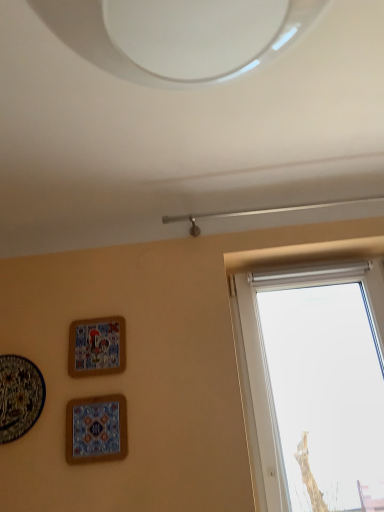
Where is `matte ceramic plate at lower left, acting as the 3th picture frame starting from the right`? This screenshot has width=384, height=512. matte ceramic plate at lower left, acting as the 3th picture frame starting from the right is located at coordinates (19, 396).

Where is `matte ceramic tile at lower left, marked as the first picture frame in a right-to-left arrangement`? Image resolution: width=384 pixels, height=512 pixels. matte ceramic tile at lower left, marked as the first picture frame in a right-to-left arrangement is located at coordinates (96, 429).

Locate an element on the screen. The width and height of the screenshot is (384, 512). matte ceramic picture frame at upper left, placed as the 2th picture frame when sorted from right to left is located at coordinates (96, 346).

Can you confirm if matte ceramic plate at lower left, acting as the 3th picture frame starting from the right, is shorter than matte ceramic tile at lower left, marked as the first picture frame in a right-to-left arrangement?

No.

Considering the positions of objects matte ceramic plate at lower left, acting as the 3th picture frame starting from the right, and matte ceramic tile at lower left, the 3th picture frame positioned from the left, in the image provided, who is more to the left, matte ceramic plate at lower left, acting as the 3th picture frame starting from the right, or matte ceramic tile at lower left, the 3th picture frame positioned from the left,?

matte ceramic plate at lower left, acting as the 3th picture frame starting from the right.

Is matte ceramic plate at lower left, the 1th picture frame from the left, positioned with its back to matte ceramic tile at lower left, the 3th picture frame positioned from the left?

matte ceramic plate at lower left, the 1th picture frame from the left, is not turned away from matte ceramic tile at lower left, the 3th picture frame positioned from the left.

Are matte ceramic plate at lower left, the 1th picture frame from the left, and matte ceramic tile at lower left, marked as the first picture frame in a right-to-left arrangement, far apart?

matte ceramic plate at lower left, the 1th picture frame from the left, is actually quite close to matte ceramic tile at lower left, marked as the first picture frame in a right-to-left arrangement.

Does point (71, 458) come farther from viewer compared to point (3, 392)?

That is False.

Is matte ceramic tile at lower left, the 3th picture frame positioned from the left, oriented away from matte ceramic plate at lower left, acting as the 3th picture frame starting from the right?

That's not correct — matte ceramic tile at lower left, the 3th picture frame positioned from the left, is not looking away from matte ceramic plate at lower left, acting as the 3th picture frame starting from the right.

From the image's perspective, does matte ceramic tile at lower left, marked as the first picture frame in a right-to-left arrangement, appear lower than matte ceramic plate at lower left, the 1th picture frame from the left?

Yes, from the image's perspective, matte ceramic tile at lower left, marked as the first picture frame in a right-to-left arrangement, is below matte ceramic plate at lower left, the 1th picture frame from the left.

From a real-world perspective, does matte ceramic tile at lower left, the 3th picture frame positioned from the left, stand above matte ceramic plate at lower left, the 1th picture frame from the left?

Incorrect, from a real-world perspective, matte ceramic tile at lower left, the 3th picture frame positioned from the left, is lower than matte ceramic plate at lower left, the 1th picture frame from the left.

From the image's perspective, would you say matte ceramic plate at lower left, acting as the 3th picture frame starting from the right, is shown under matte ceramic picture frame at upper left, placed as the 2th picture frame when sorted from right to left?

Correct, matte ceramic plate at lower left, acting as the 3th picture frame starting from the right, appears lower than matte ceramic picture frame at upper left, placed as the 2th picture frame when sorted from right to left, in the image.

Is matte ceramic plate at lower left, acting as the 3th picture frame starting from the right, in contact with matte ceramic picture frame at upper left, placed as the 2th picture frame when sorted from right to left?

matte ceramic plate at lower left, acting as the 3th picture frame starting from the right, is not next to matte ceramic picture frame at upper left, placed as the 2th picture frame when sorted from right to left, and they're not touching.

Is matte ceramic plate at lower left, the 1th picture frame from the left, looking in the opposite direction of matte ceramic picture frame at upper left, placed as the 2th picture frame when sorted from right to left?

matte ceramic plate at lower left, the 1th picture frame from the left, is not turned away from matte ceramic picture frame at upper left, placed as the 2th picture frame when sorted from right to left.

Is matte ceramic plate at lower left, the 1th picture frame from the left, situated inside matte ceramic picture frame at upper left, positioned as the second picture frame in left-to-right order, or outside?

matte ceramic plate at lower left, the 1th picture frame from the left, lies outside matte ceramic picture frame at upper left, positioned as the second picture frame in left-to-right order.

Is matte ceramic picture frame at upper left, positioned as the second picture frame in left-to-right order, inside the boundaries of matte ceramic tile at lower left, marked as the first picture frame in a right-to-left arrangement, or outside?

The correct answer is: outside.

Is matte ceramic picture frame at upper left, placed as the 2th picture frame when sorted from right to left, aimed at matte ceramic tile at lower left, the 3th picture frame positioned from the left?

No.

Looking at their sizes, would you say matte ceramic picture frame at upper left, positioned as the second picture frame in left-to-right order, is wider or thinner than matte ceramic tile at lower left, the 3th picture frame positioned from the left?

Considering their sizes, matte ceramic picture frame at upper left, positioned as the second picture frame in left-to-right order, looks broader than matte ceramic tile at lower left, the 3th picture frame positioned from the left.

Is matte ceramic picture frame at upper left, positioned as the second picture frame in left-to-right order, next to matte ceramic tile at lower left, the 3th picture frame positioned from the left?

They are not placed beside each other.

Is matte ceramic picture frame at upper left, positioned as the second picture frame in left-to-right order, with matte ceramic plate at lower left, the 1th picture frame from the left?

No, matte ceramic picture frame at upper left, positioned as the second picture frame in left-to-right order, is not making contact with matte ceramic plate at lower left, the 1th picture frame from the left.

This screenshot has width=384, height=512. Identify the location of picture frame that is above the matte ceramic plate at lower left, the 1th picture frame from the left (from the image's perspective). (96, 346).

Is matte ceramic picture frame at upper left, positioned as the second picture frame in left-to-right order, not inside matte ceramic plate at lower left, acting as the 3th picture frame starting from the right?

Yes, matte ceramic picture frame at upper left, positioned as the second picture frame in left-to-right order, is not within matte ceramic plate at lower left, acting as the 3th picture frame starting from the right.

Between point (75, 454) and point (118, 336), which one is positioned behind?

The point (118, 336) is farther.

In the scene shown: Are matte ceramic tile at lower left, marked as the first picture frame in a right-to-left arrangement, and matte ceramic picture frame at upper left, placed as the 2th picture frame when sorted from right to left, far apart?

No, matte ceramic tile at lower left, marked as the first picture frame in a right-to-left arrangement, is not far away from matte ceramic picture frame at upper left, placed as the 2th picture frame when sorted from right to left.

Which of these two, matte ceramic tile at lower left, the 3th picture frame positioned from the left, or matte ceramic picture frame at upper left, positioned as the second picture frame in left-to-right order, is bigger?

With larger size is matte ceramic picture frame at upper left, positioned as the second picture frame in left-to-right order.

The height and width of the screenshot is (512, 384). What are the coordinates of `the 1st picture frame positioned above the matte ceramic tile at lower left, marked as the first picture frame in a right-to-left arrangement (from the image's perspective)` in the screenshot? It's located at (19, 396).

Where is `the 2nd picture frame counting from the left side of the matte ceramic tile at lower left, marked as the first picture frame in a right-to-left arrangement`? the 2nd picture frame counting from the left side of the matte ceramic tile at lower left, marked as the first picture frame in a right-to-left arrangement is located at coordinates (19, 396).

When comparing their distances from matte ceramic plate at lower left, acting as the 3th picture frame starting from the right, does matte ceramic picture frame at upper left, placed as the 2th picture frame when sorted from right to left, or matte ceramic tile at lower left, marked as the first picture frame in a right-to-left arrangement, seem closer?

matte ceramic tile at lower left, marked as the first picture frame in a right-to-left arrangement, is positioned closer to the anchor matte ceramic plate at lower left, acting as the 3th picture frame starting from the right.

Considering their positions, is matte ceramic tile at lower left, the 3th picture frame positioned from the left, positioned further to matte ceramic plate at lower left, the 1th picture frame from the left, than matte ceramic picture frame at upper left, positioned as the second picture frame in left-to-right order?

matte ceramic picture frame at upper left, positioned as the second picture frame in left-to-right order, lies further to matte ceramic plate at lower left, the 1th picture frame from the left, than the other object.

Based on their spatial positions, is matte ceramic plate at lower left, the 1th picture frame from the left, or matte ceramic tile at lower left, marked as the first picture frame in a right-to-left arrangement, closer to matte ceramic picture frame at upper left, positioned as the second picture frame in left-to-right order?

Based on the image, matte ceramic tile at lower left, marked as the first picture frame in a right-to-left arrangement, appears to be nearer to matte ceramic picture frame at upper left, positioned as the second picture frame in left-to-right order.

From the image, which object appears to be farther from matte ceramic tile at lower left, marked as the first picture frame in a right-to-left arrangement, matte ceramic plate at lower left, acting as the 3th picture frame starting from the right, or matte ceramic picture frame at upper left, positioned as the second picture frame in left-to-right order?

Among the two, matte ceramic plate at lower left, acting as the 3th picture frame starting from the right, is located further to matte ceramic tile at lower left, marked as the first picture frame in a right-to-left arrangement.

Which object lies further to the anchor point matte ceramic tile at lower left, marked as the first picture frame in a right-to-left arrangement, matte ceramic picture frame at upper left, placed as the 2th picture frame when sorted from right to left, or matte ceramic plate at lower left, acting as the 3th picture frame starting from the right?

matte ceramic plate at lower left, acting as the 3th picture frame starting from the right, is further to matte ceramic tile at lower left, marked as the first picture frame in a right-to-left arrangement.

Estimate the real-world distances between objects in this image. Which object is further from matte ceramic picture frame at upper left, positioned as the second picture frame in left-to-right order, matte ceramic tile at lower left, the 3th picture frame positioned from the left, or matte ceramic plate at lower left, acting as the 3th picture frame starting from the right?

The object further to matte ceramic picture frame at upper left, positioned as the second picture frame in left-to-right order, is matte ceramic plate at lower left, acting as the 3th picture frame starting from the right.

I want to click on picture frame situated between matte ceramic plate at lower left, the 1th picture frame from the left, and matte ceramic tile at lower left, the 3th picture frame positioned from the left, from left to right, so click(x=96, y=346).